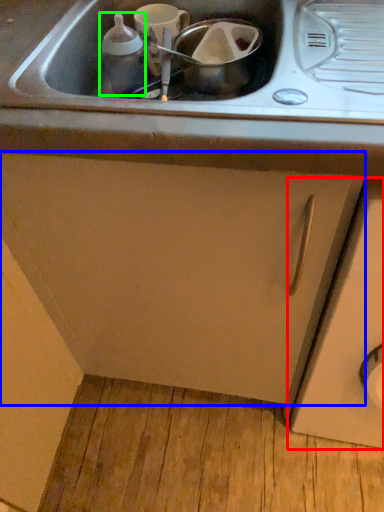
Question: Estimate the real-world distances between objects in this image. Which object is farther from cabinetry (highlighted by a red box), cabinetry (highlighted by a blue box) or bottle (highlighted by a green box)?

Choices:
 (A) cabinetry
 (B) bottle

Answer: (B)